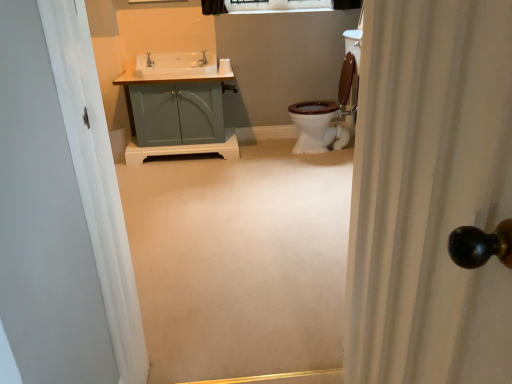
The height and width of the screenshot is (384, 512). I want to click on free location to the left of white matte toilet paper at upper center, so click(x=208, y=68).